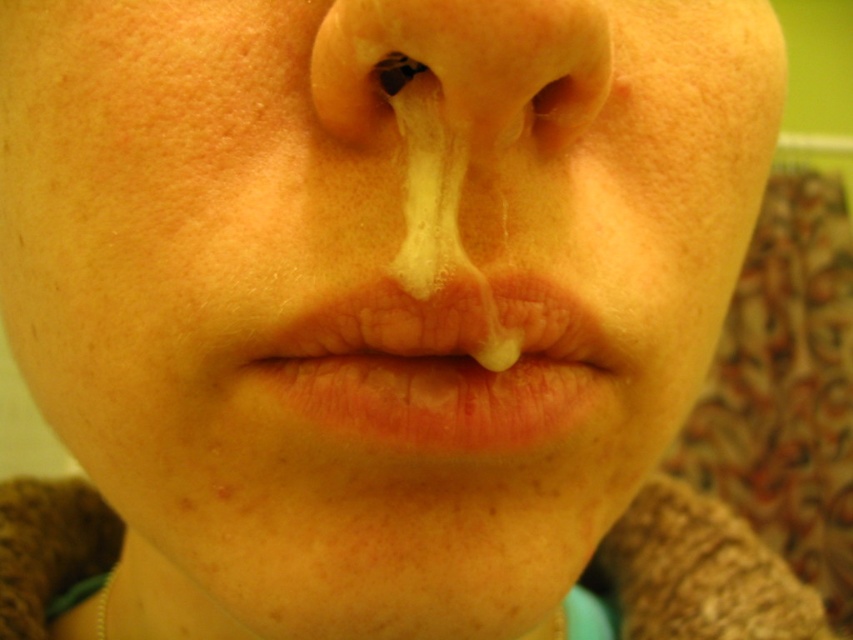
You are a makeup artist preparing to apply lipstick on a client. The client has dry matte lips at center. Based on the image, where exactly should you apply the lipstick?

You should apply the lipstick on the dry matte lips at center located at point coordinates of [445,364].